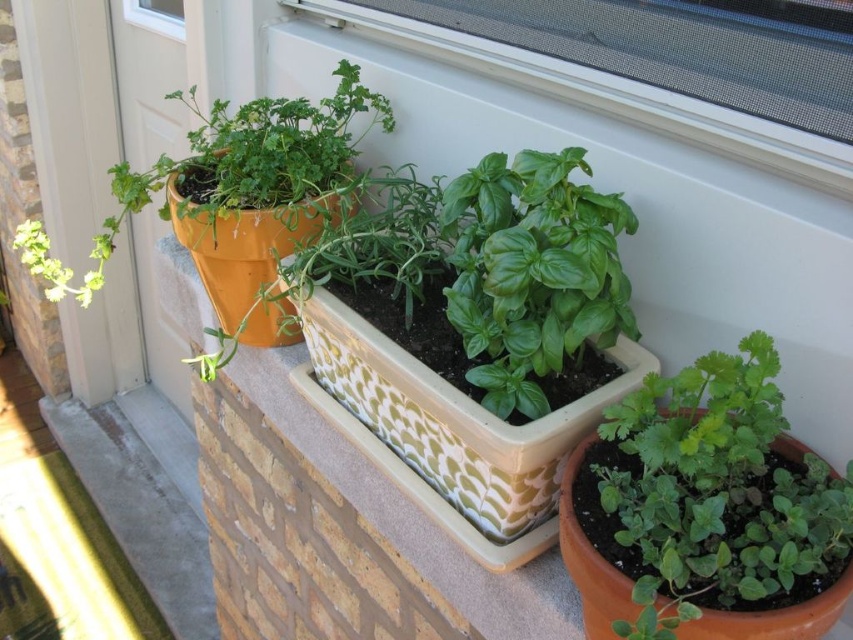
Between green matte herb at lower right and matte orange pot at left, which one is positioned lower?

Positioned lower is green matte herb at lower right.

Does green matte herb at lower right have a lesser width compared to matte orange pot at left?

Yes.

Measure the distance between green matte herb at lower right and camera.

green matte herb at lower right and camera are 19.20 inches apart.

The image size is (853, 640). Find the location of `green matte herb at lower right`. green matte herb at lower right is located at coordinates (712, 496).

Between green matte herb at lower right and green glossy basil at center, which one has less height?

With less height is green matte herb at lower right.

What do you see at coordinates (712, 496) in the screenshot? The width and height of the screenshot is (853, 640). I see `green matte herb at lower right` at bounding box center [712, 496].

The image size is (853, 640). I want to click on green matte herb at lower right, so click(712, 496).

Does white textured rectangular planter at center appear under transparent plastic window at upper center?

Yes, white textured rectangular planter at center is below transparent plastic window at upper center.

Between point (490, 426) and point (689, 120), which one is positioned in front?

Point (490, 426)

Which is in front, point (373, 436) or point (780, 140)?

Point (780, 140) is more forward.

Where is `white textured rectangular planter at center`? white textured rectangular planter at center is located at coordinates 451,428.